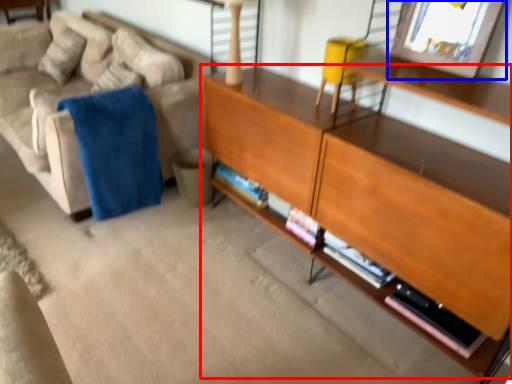
Question: Which of the following is the closest to the observer, shelf (highlighted by a red box) or picture frame (highlighted by a blue box)?

Choices:
 (A) shelf
 (B) picture frame

Answer: (A)